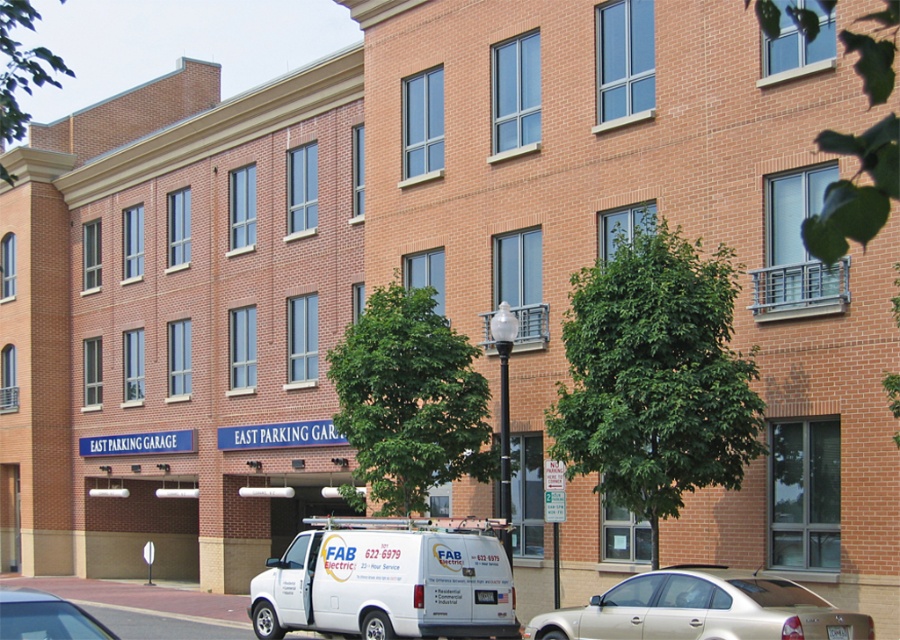
Can you confirm if gold metallic sedan at lower center is positioned to the left of white matte van at lower left?

No, gold metallic sedan at lower center is not to the left of white matte van at lower left.

What are the coordinates of `gold metallic sedan at lower center` in the screenshot? It's located at (702, 609).

Does white matte van at center have a greater width compared to gold metallic sedan at lower center?

No, white matte van at center is not wider than gold metallic sedan at lower center.

Between white matte van at center and gold metallic sedan at lower center, which one has less height?

Standing shorter between the two is white matte van at center.

Is point (482, 588) farther from viewer compared to point (650, 632)?

Yes, it is behind point (650, 632).

You are a GUI agent. You are given a task and a screenshot of the screen. Output one action in this format:
    pyautogui.click(x=<x>, y=<y>)
    Task: Click on the white matte van at center
    Image resolution: width=900 pixels, height=640 pixels.
    Given the screenshot: What is the action you would take?
    pyautogui.click(x=388, y=580)

Between white matte van at center and white matte van at lower left, which one appears on the right side from the viewer's perspective?

From the viewer's perspective, white matte van at center appears more on the right side.

Which is above, white matte van at center or white matte van at lower left?

white matte van at lower left is above.

Is point (383, 589) positioned before point (88, 628)?

That is False.

At what (x,y) coordinates should I click in order to perform the action: click on white matte van at center. Please return your answer as a coordinate pair (x, y). The width and height of the screenshot is (900, 640). Looking at the image, I should click on (388, 580).